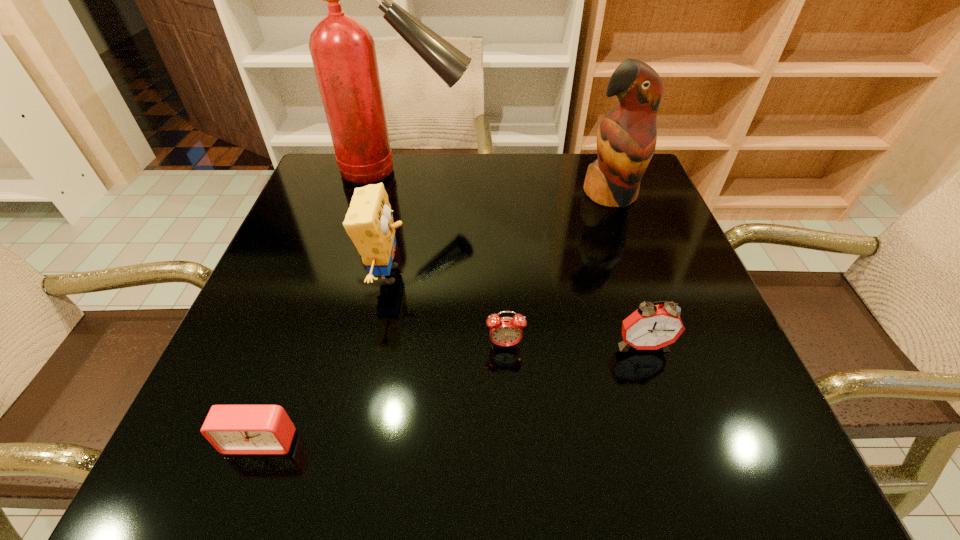
Identify the location of unoccupied area between the nearest object and the fire extinguisher. (331, 306).

Identify the location of free space between the nearest alarm clock and the second tallest object. (436, 318).

Where is `vacant space that is in between the third object from right to left and the tallest object`? Image resolution: width=960 pixels, height=540 pixels. vacant space that is in between the third object from right to left and the tallest object is located at coordinates (453, 259).

This screenshot has width=960, height=540. Find the location of `empty space between the leftmost alarm clock and the fourth tallest object`. empty space between the leftmost alarm clock and the fourth tallest object is located at coordinates (452, 393).

Locate an element on the screen. The image size is (960, 540). vacant region between the third tallest object and the leftmost alarm clock is located at coordinates (324, 357).

The image size is (960, 540). What are the coordinates of `vacant point located between the nearest alarm clock and the fire extinguisher` in the screenshot? It's located at (331, 306).

What are the coordinates of `vacant space that's between the nearest object and the parrot` in the screenshot? It's located at (436, 318).

Where is `vacant area that lies between the nearest object and the rightmost alarm clock`? The height and width of the screenshot is (540, 960). vacant area that lies between the nearest object and the rightmost alarm clock is located at coordinates (452, 393).

Identify the location of vacant region between the nearest object and the second tallest object. (436, 318).

Locate which object ranks fifth in proximity to the second tallest object. Please provide its 2D coordinates. Your answer should be formatted as a tuple, i.e. [(x, y)], where the tuple contains the x and y coordinates of a point satisfying the conditions above.

[(232, 429)]